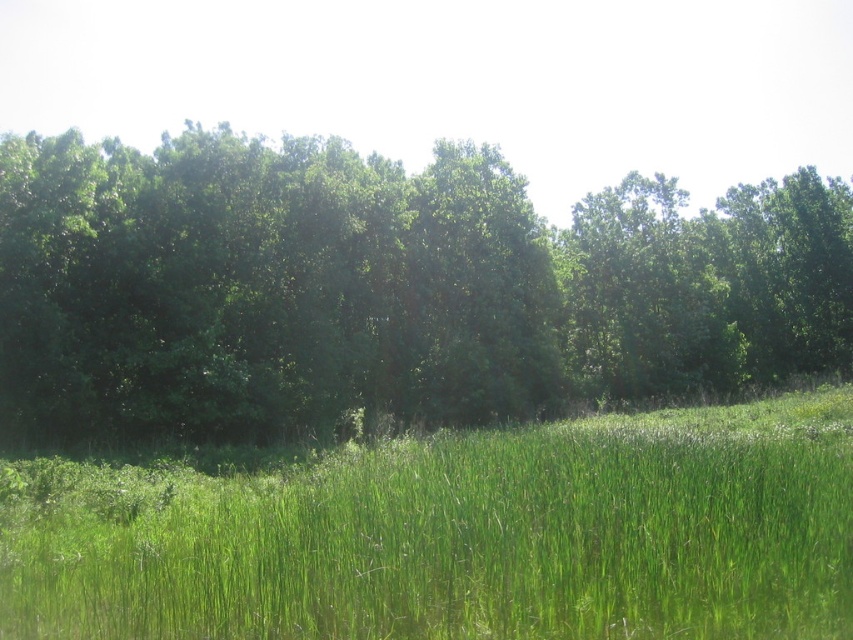
Question: Which of the following is the farthest from the observer?

Choices:
 (A) green leafy trees at center
 (B) green grassy pasture at lower center

Answer: (A)

Question: Can you confirm if green leafy trees at center is positioned to the right of green grassy pasture at lower center?

Choices:
 (A) no
 (B) yes

Answer: (B)

Question: From the image, what is the correct spatial relationship of green leafy trees at center in relation to green grassy pasture at lower center?

Choices:
 (A) below
 (B) above

Answer: (B)

Question: Is green leafy trees at center above green grassy pasture at lower center?

Choices:
 (A) yes
 (B) no

Answer: (A)